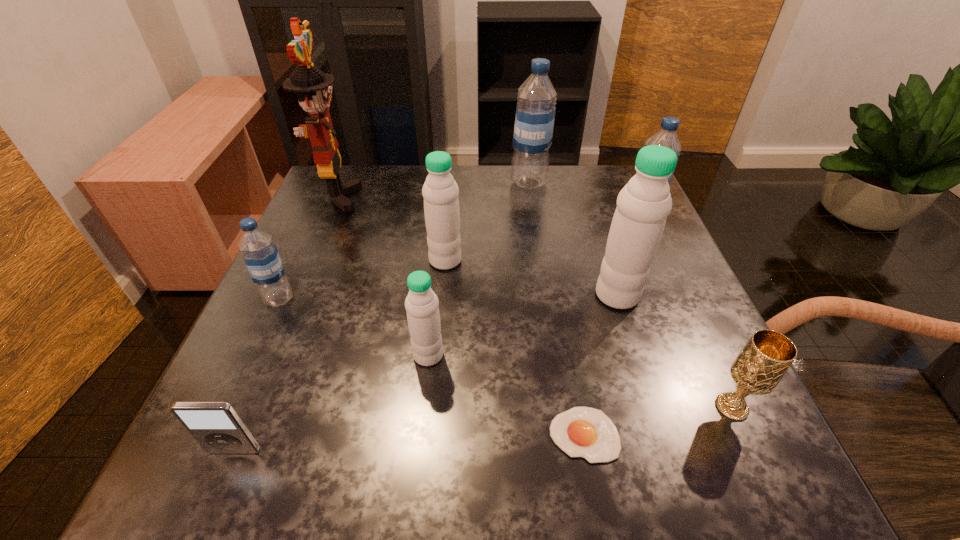
The height and width of the screenshot is (540, 960). What are the coordinates of `vacant space located on the left of the fifth water bottle from left to right` in the screenshot? It's located at (465, 295).

Identify the location of blank area located 0.100m on the right of the fourth farthest object. Image resolution: width=960 pixels, height=540 pixels. (510, 260).

This screenshot has height=540, width=960. In order to click on vacant space located 0.370m on the label of the second farthest blue water bottle in this screenshot , I will do `click(466, 219)`.

I want to click on vacant space situated 0.330m on the label of the second farthest blue water bottle, so click(483, 219).

Locate an element on the screen. vacant region located on the label of the second farthest blue water bottle is located at coordinates (457, 219).

Where is `vacant point located on the right of the nearest white water bottle`? The image size is (960, 540). vacant point located on the right of the nearest white water bottle is located at coordinates (527, 355).

Locate an element on the screen. The image size is (960, 540). vacant space located on the label of the nearest blue water bottle is located at coordinates click(203, 465).

Locate an element on the screen. This screenshot has height=540, width=960. vacant space situated on the back of the chalice is located at coordinates (682, 299).

In order to click on vacant space situated 0.050m on the front-facing side of the ninth tallest object in this screenshot , I will do `click(217, 492)`.

The width and height of the screenshot is (960, 540). Find the location of `vacant space located on the back of the egg yolk`. vacant space located on the back of the egg yolk is located at coordinates (560, 299).